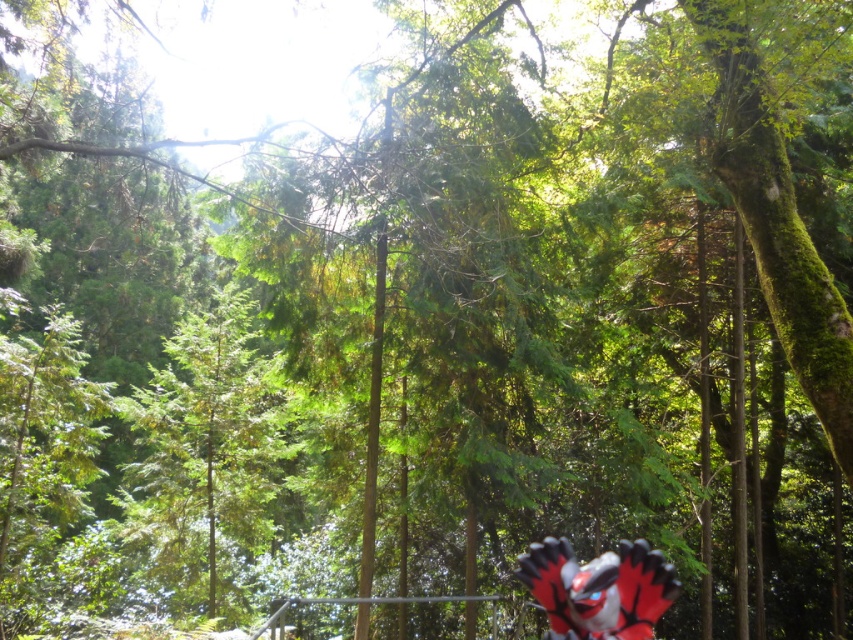
Question: Is green textured tree at center above red and black plush toy at bottom right?

Choices:
 (A) no
 (B) yes

Answer: (A)

Question: Does green textured tree at center lie behind red and black plush toy at bottom right?

Choices:
 (A) yes
 (B) no

Answer: (A)

Question: Which object appears closest to the camera in this image?

Choices:
 (A) red and black plush toy at bottom right
 (B) green textured tree at center

Answer: (A)

Question: Does green textured tree at center have a lesser width compared to red and black plush toy at bottom right?

Choices:
 (A) yes
 (B) no

Answer: (A)